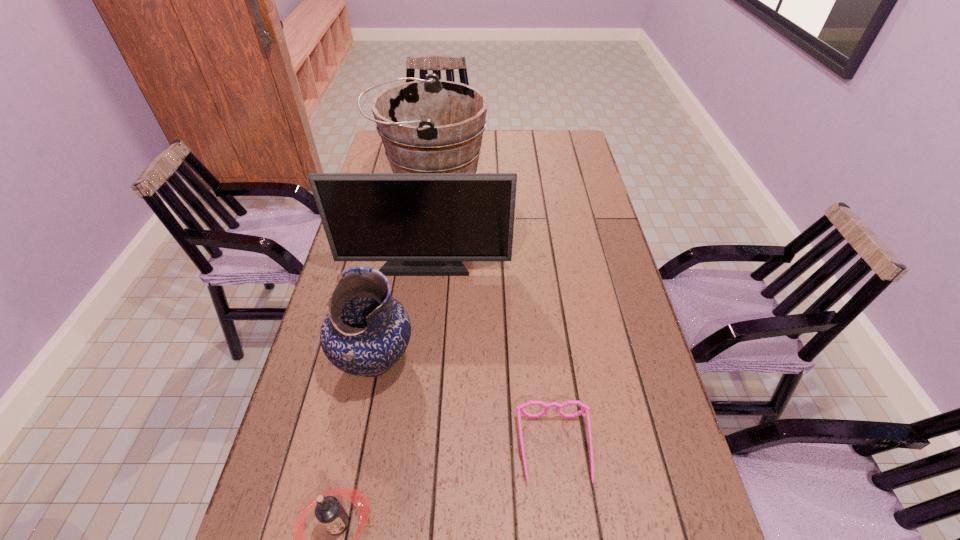
At what (x,y) coordinates should I click in order to perform the action: click on empty space that is in between the second farthest object and the spectacles. Please return your answer as a coordinate pair (x, y). Looking at the image, I should click on (490, 356).

Choose which object is the nearest neighbor to the second nearest object. Please provide its 2D coordinates. Your answer should be formatted as a tuple, i.e. [(x, y)], where the tuple contains the x and y coordinates of a point satisfying the conditions above.

[(366, 331)]

You are a GUI agent. You are given a task and a screenshot of the screen. Output one action in this format:
    pyautogui.click(x=<x>, y=<y>)
    Task: Click on the closest object relative to the third nearest object
    
    Given the screenshot: What is the action you would take?
    pyautogui.click(x=423, y=224)